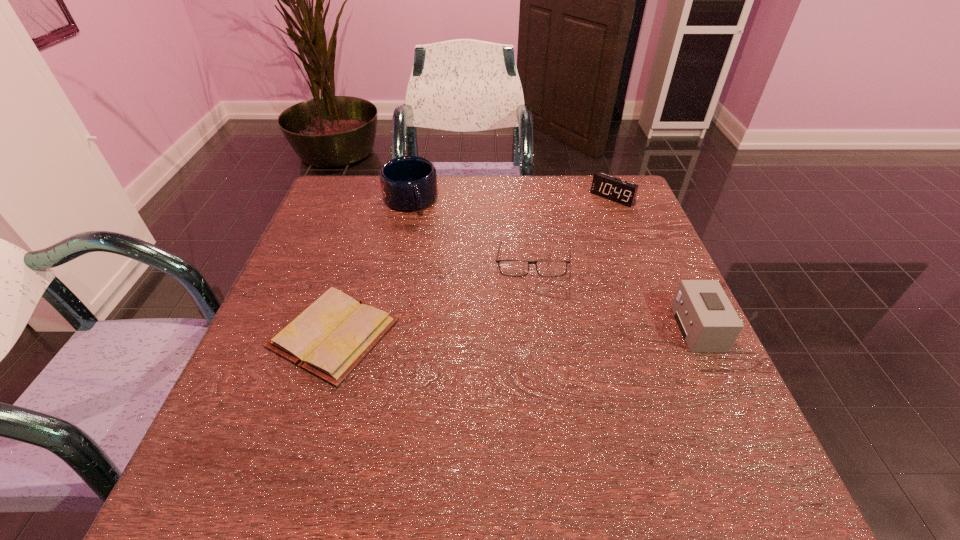
You are a GUI agent. You are given a task and a screenshot of the screen. Output one action in this format:
    pyautogui.click(x=<x>, y=<y>)
    Task: Click on the free space located on the front-facing side of the farther alarm clock
    The image size is (960, 540).
    Given the screenshot: What is the action you would take?
    pyautogui.click(x=555, y=252)

At what (x,y) coordinates should I click in order to perform the action: click on vacant area located 0.220m on the front-facing side of the farther alarm clock. Please return your answer as a coordinate pair (x, y). This screenshot has height=540, width=960. Looking at the image, I should click on (564, 245).

Identify the location of vacant space positioned on the front-facing side of the farther alarm clock. (575, 233).

Locate an element on the screen. vacant area situated with the lenses facing outward on the spectacles is located at coordinates (423, 368).

At what (x,y) coordinates should I click in order to perform the action: click on free point located 0.340m with the lenses facing outward on the spectacles. Please return your answer as a coordinate pair (x, y). Looking at the image, I should click on (413, 379).

This screenshot has width=960, height=540. I want to click on free point located with the lenses facing outward on the spectacles, so click(423, 368).

What are the coordinates of `mug at the far edge` in the screenshot? It's located at (408, 183).

Image resolution: width=960 pixels, height=540 pixels. What are the coordinates of `alarm clock present at the far edge` in the screenshot? It's located at (617, 190).

At what (x,y) coordinates should I click in order to perform the action: click on object at the left edge. Please return your answer as a coordinate pair (x, y). This screenshot has width=960, height=540. Looking at the image, I should click on (329, 338).

Locate an element on the screen. object that is at the far right corner is located at coordinates (617, 190).